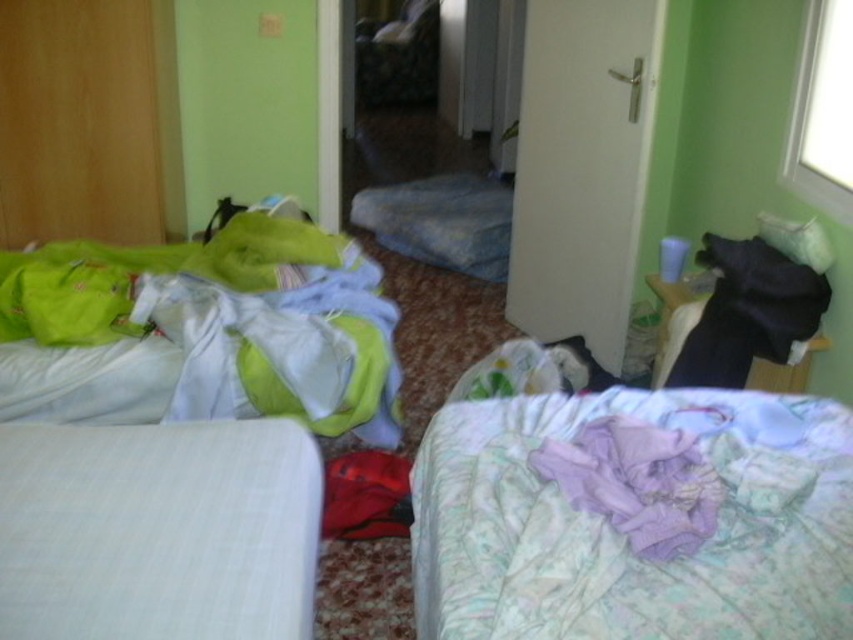
Can you confirm if light purple floral blanket at lower right is wider than matte green fabric at left?

No, light purple floral blanket at lower right is not wider than matte green fabric at left.

The width and height of the screenshot is (853, 640). What do you see at coordinates (634, 518) in the screenshot? I see `light purple floral blanket at lower right` at bounding box center [634, 518].

Is point (682, 525) farther from camera compared to point (126, 364)?

That is False.

The height and width of the screenshot is (640, 853). I want to click on light purple floral blanket at lower right, so click(634, 518).

Does point (306, 234) lie behind point (152, 472)?

That is True.

The height and width of the screenshot is (640, 853). What do you see at coordinates (202, 330) in the screenshot? I see `matte green fabric at left` at bounding box center [202, 330].

Is point (236, 404) farther from camera compared to point (109, 577)?

Yes.

You are a GUI agent. You are given a task and a screenshot of the screen. Output one action in this format:
    pyautogui.click(x=<x>, y=<y>)
    Task: Click on the matte green fabric at left
    The height and width of the screenshot is (640, 853).
    Given the screenshot: What is the action you would take?
    pyautogui.click(x=202, y=330)

Is light purple floral blanket at lower right bigger than white cotton bedcover at lower left?

Yes.

Is point (596, 417) positioned before point (115, 516)?

No.

Where is `light purple floral blanket at lower right`? Image resolution: width=853 pixels, height=640 pixels. light purple floral blanket at lower right is located at coordinates (634, 518).